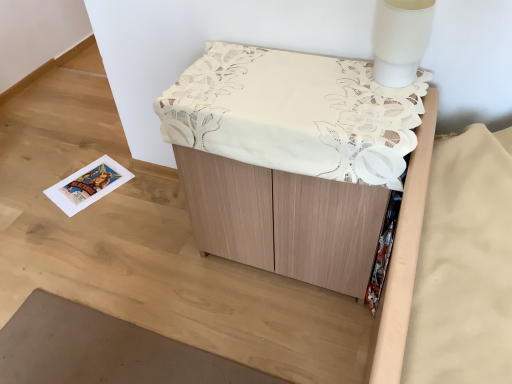
Where is `free space in front of white matte table lamp at upper right`? This screenshot has height=384, width=512. free space in front of white matte table lamp at upper right is located at coordinates (387, 109).